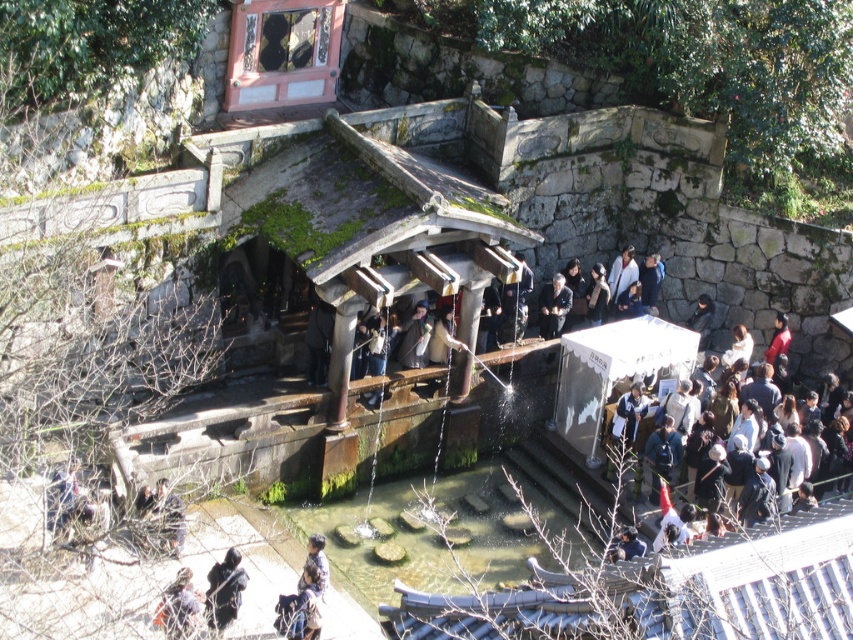
You are standing at the entrance of the pavilion and want to find the person wearing the dark blue uniform at center. Which direction should you look to find them?

The dark blue uniform at center is located at the center of the image, so you should look towards the middle area of the pavilion to find them.

You are a photographer trying to capture a group photo of the tourists in front of the pavilion. You notice the dark brown leather jacket at center and the dark blue fabric at center. Which clothing item should you focus on to ensure it fits entirely within the camera frame if the frame can only accommodate the narrower of the two?

The dark blue fabric at center should be focused on since its width is narrower than the dark brown leather jacket at center, ensuring it fits within the camera frame.

You are a tour guide leading a group at the historical site. You notice the white fabric bag at center and the blue denim jacket at lower center. Which object is wider?

The white fabric bag at center is wider than the blue denim jacket at lower center according to the description.